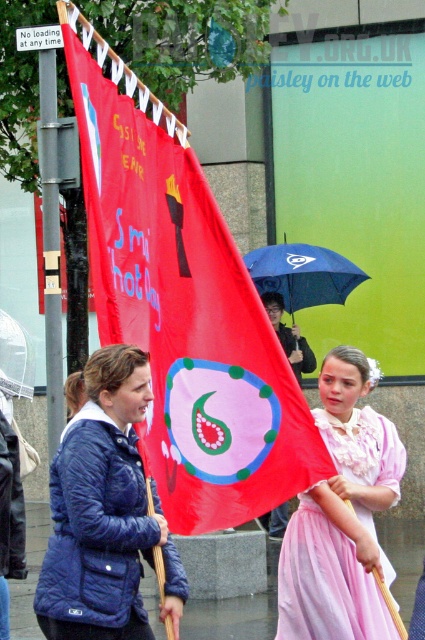
Question: Which object is the closest to the transparent plastic umbrella at center?

Choices:
 (A) red fabric flag at center
 (B) pink satin dress at center
 (C) blue matte umbrella at center
 (D) navy quilted jacket at center

Answer: (C)

Question: Which object is positioned closest to the transparent plastic umbrella at center?

Choices:
 (A) navy quilted jacket at center
 (B) red fabric flag at center

Answer: (B)

Question: Does red fabric flag at center appear on the left side of navy quilted jacket at center?

Choices:
 (A) yes
 (B) no

Answer: (B)

Question: Is red fabric flag at center thinner than pink satin dress at center?

Choices:
 (A) no
 (B) yes

Answer: (A)

Question: Which object is closer to the camera taking this photo?

Choices:
 (A) pink satin dress at center
 (B) navy quilted jacket at center
 (C) blue matte umbrella at center
 (D) transparent plastic umbrella at center

Answer: (B)

Question: Considering the relative positions of red fabric flag at center and pink satin dress at center in the image provided, where is red fabric flag at center located with respect to pink satin dress at center?

Choices:
 (A) below
 (B) above

Answer: (B)